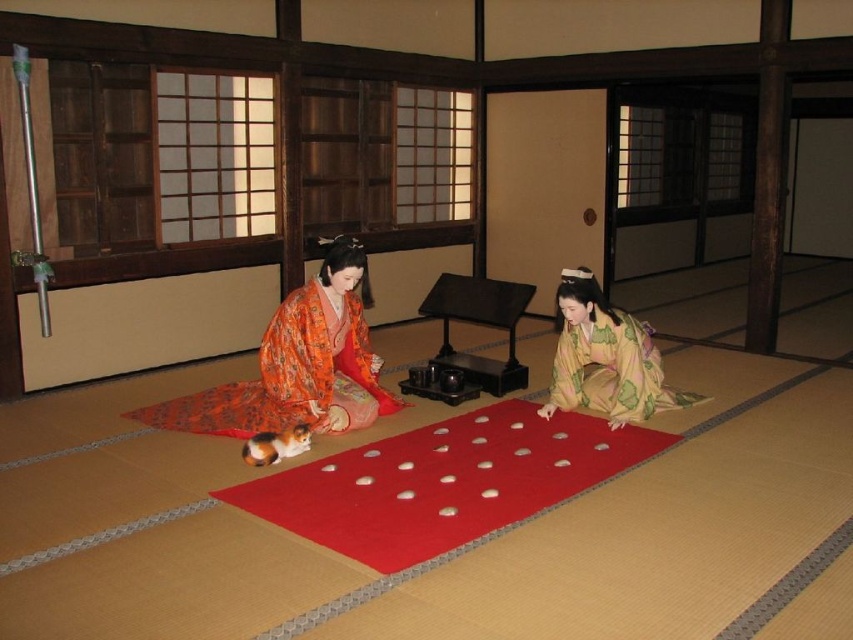
Question: Does red felt mat at center come behind orange floral kimono at center?

Choices:
 (A) no
 (B) yes

Answer: (A)

Question: Among these points, which one is nearest to the camera?

Choices:
 (A) (613, 372)
 (B) (287, 332)

Answer: (B)

Question: Estimate the real-world distances between objects in this image. Which object is farther from the yellow-green silk kimono at lower right?

Choices:
 (A) orange floral kimono at center
 (B) red felt mat at center

Answer: (A)

Question: Is red felt mat at center to the left of orange floral kimono at center from the viewer's perspective?

Choices:
 (A) no
 (B) yes

Answer: (A)

Question: Which of the following is the farthest from the observer?

Choices:
 (A) orange floral kimono at center
 (B) red felt mat at center
 (C) yellow-green silk kimono at lower right

Answer: (C)

Question: Does red felt mat at center lie in front of yellow-green silk kimono at lower right?

Choices:
 (A) no
 (B) yes

Answer: (B)